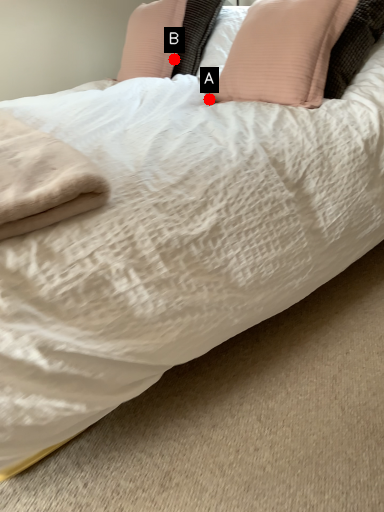
Question: Two points are circled on the image, labeled by A and B beside each circle. Which of the following is the closest to the observer?

Choices:
 (A) A is closer
 (B) B is closer

Answer: (A)